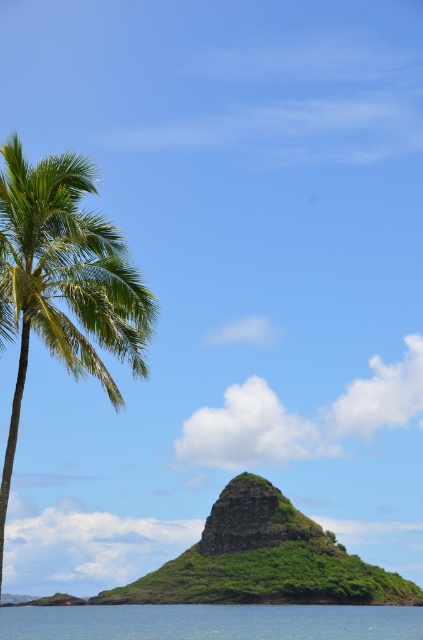
Is green leafy palm tree at left bigger than blue water at lower center?

Incorrect, green leafy palm tree at left is not larger than blue water at lower center.

Can you confirm if green leafy palm tree at left is wider than blue water at lower center?

Incorrect, green leafy palm tree at left's width does not surpass blue water at lower center's.

Who is more forward, [18,392] or [36,609]?

Point [18,392]

Locate an element on the screen. The height and width of the screenshot is (640, 423). green leafy palm tree at left is located at coordinates (65, 280).

Does green leafy palm tree at left appear on the right side of green grassy rock at center?

No, green leafy palm tree at left is not to the right of green grassy rock at center.

Where is `green leafy palm tree at left`? green leafy palm tree at left is located at coordinates (65, 280).

Is point (22, 324) positioned before point (219, 552)?

That is True.

Locate an element on the screen. The width and height of the screenshot is (423, 640). green leafy palm tree at left is located at coordinates (65, 280).

Which is in front, point (318, 630) or point (277, 536)?

Point (318, 630) is in front.

Which of these two, blue water at lower center or green grassy rock at center, stands shorter?

green grassy rock at center is shorter.

Who is more distant from viewer, [74,625] or [211,534]?

The point [211,534] is more distant.

The image size is (423, 640). In order to click on blue water at lower center in this screenshot , I will do `click(211, 621)`.